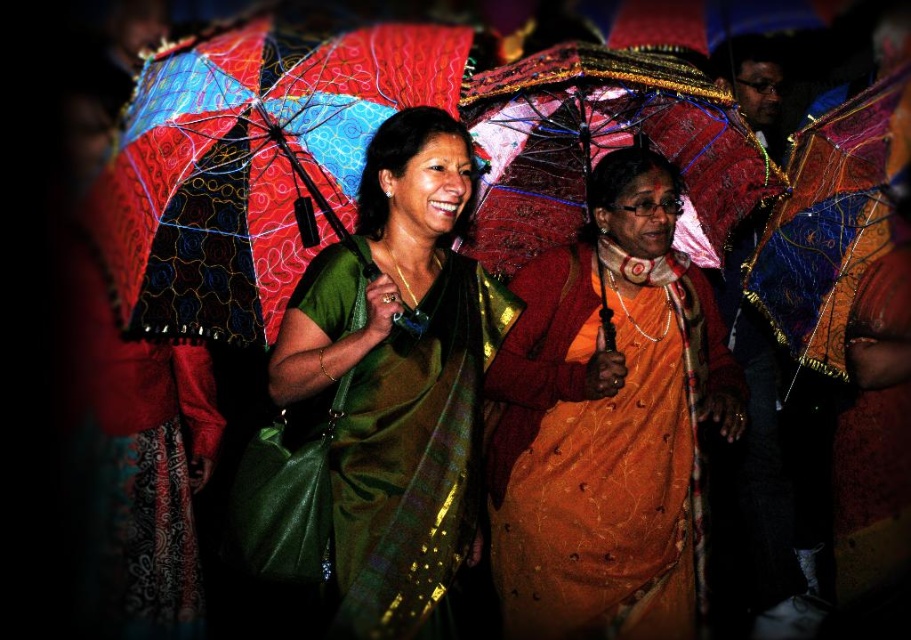
Question: From the image, what is the correct spatial relationship of multicolored fabric umbrella at upper right in relation to textured fabric umbrella at upper center?

Choices:
 (A) below
 (B) above

Answer: (A)

Question: Which of the following is the closest to the observer?

Choices:
 (A) textured fabric umbrella at center
 (B) textured fabric umbrella at upper center

Answer: (A)

Question: From the image, what is the correct spatial relationship of green silk saree at center in relation to textured fabric umbrella at center?

Choices:
 (A) left
 (B) right

Answer: (A)

Question: Which of the following is the closest to the observer?

Choices:
 (A) (341, 273)
 (B) (795, 289)
 (C) (609, 12)

Answer: (A)

Question: Estimate the real-world distances between objects in this image. Which object is farther from the green silk saree at center?

Choices:
 (A) orange silk saree at center
 (B) textured fabric umbrella at center
 (C) multicolored fabric umbrella at upper right
 (D) textured fabric umbrella at upper center

Answer: (D)

Question: Can you confirm if orange silk saree at center is smaller than textured fabric umbrella at upper center?

Choices:
 (A) no
 (B) yes

Answer: (B)